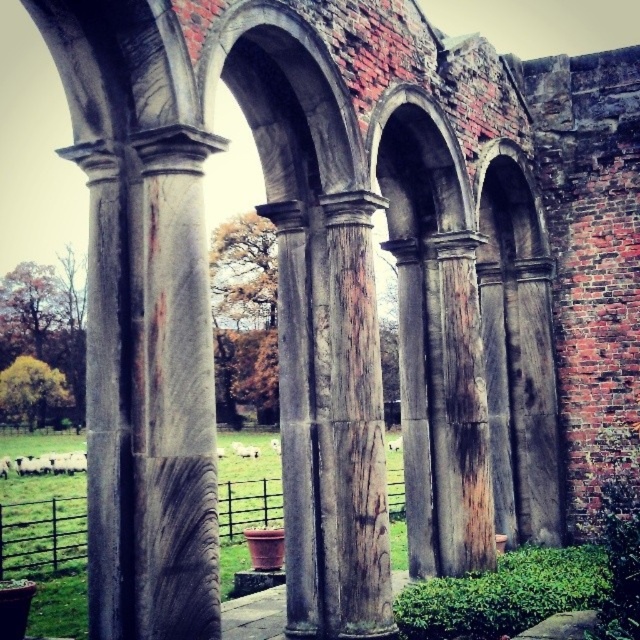
You are an architect examining the ancient stone structure. You notice the marble column at center and the rusty metal archway at center. Which of these two objects is smaller in size?

The marble column at center has a smaller size compared to the rusty metal archway at center, so the marble column at center is smaller.